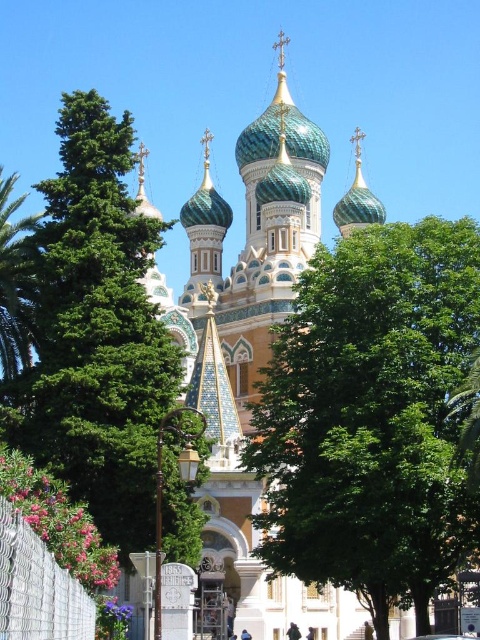
You are standing in the courtyard of the cathedral and want to plant a new tree that requires a space wider than the green leafy tree at left. Can the space where the green leafy tree at center is currently planted accommodate this new tree?

The green leafy tree at center has a greater width than the green leafy tree at left. Therefore, the space where the green leafy tree at center is planted can accommodate the new tree requiring a wider space.

You are standing in the courtyard of the cathedral and want to take a photo that includes both the green leafy tree at center and the green leafy tree at left. Which tree should you position closer to the camera to ensure both are fully visible in the frame?

You should position the green leafy tree at center closer to the camera because it is shorter than the green leafy tree at left, allowing both to be fully visible in the frame.